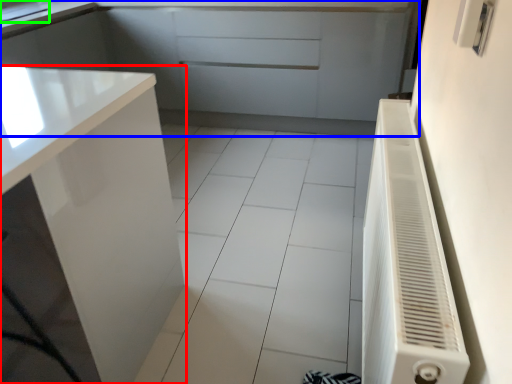
Question: Estimate the real-world distances between objects in this image. Which object is farther from cabinetry (highlighted by a red box), cabinetry (highlighted by a blue box) or sink (highlighted by a green box)?

Choices:
 (A) cabinetry
 (B) sink

Answer: (B)